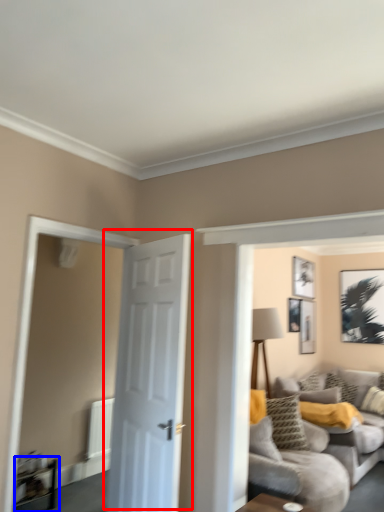
Question: Among these objects, which one is nearest to the camera, door (highlighted by a red box) or table (highlighted by a blue box)?

Choices:
 (A) door
 (B) table

Answer: (A)